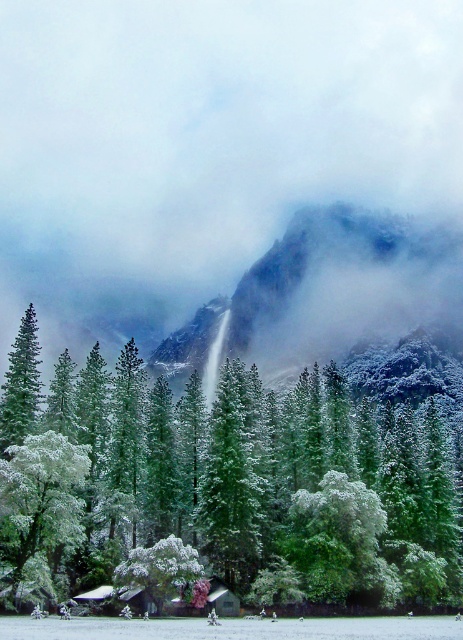
Looking at this image, is white fluffy cloud at upper center thinner than white snow-covered tree at left?

No.

Looking at this image, is white fluffy cloud at upper center taller than white snow-covered tree at left?

Yes.

You are a GUI agent. You are given a task and a screenshot of the screen. Output one action in this format:
    pyautogui.click(x=<x>, y=<y>)
    Task: Click on the white fluffy cloud at upper center
    The width and height of the screenshot is (463, 640).
    Given the screenshot: What is the action you would take?
    pyautogui.click(x=205, y=141)

Based on the photo, who is more forward, (318, 460) or (12, 518)?

Point (12, 518) is in front.

Does green matte tree at center have a greater height compared to white snow-covered tree at left?

Yes.

Which is in front, point (123, 353) or point (25, 589)?

Point (25, 589) is more forward.

The width and height of the screenshot is (463, 640). Identify the location of green matte tree at center. (232, 486).

Can you confirm if white fluffy cloud at upper center is shorter than green matte tree at center?

No.

Is point (420, 58) more distant than point (444, 593)?

That is True.

Find the location of a particular element. This screenshot has height=640, width=463. white fluffy cloud at upper center is located at coordinates (205, 141).